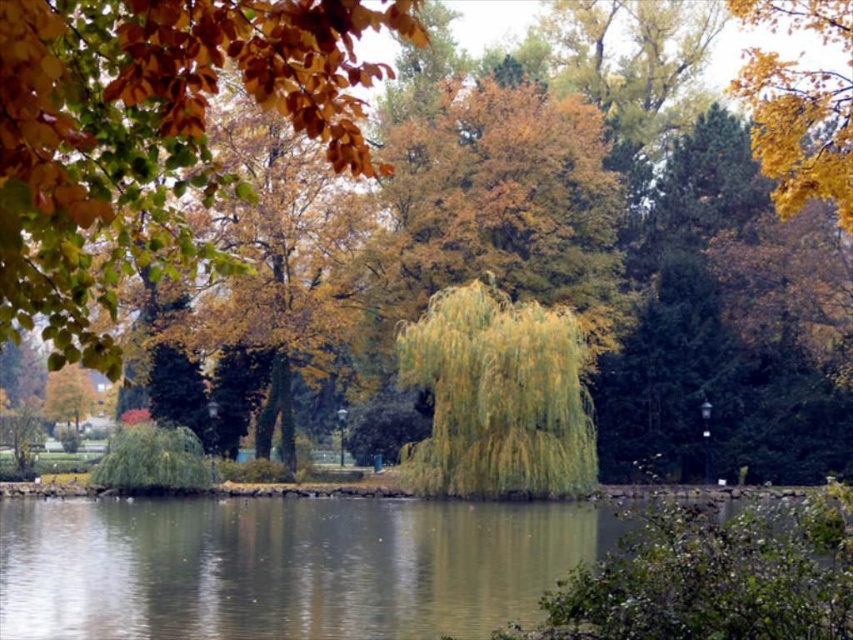
Describe the element at coordinates (285, 566) in the screenshot. I see `greenish reflective water at center` at that location.

This screenshot has height=640, width=853. I want to click on greenish reflective water at center, so click(x=285, y=566).

Describe the element at coordinates (149, 134) in the screenshot. I see `yellow-green leaves at upper left` at that location.

Does yellow-green leaves at upper left have a lesser width compared to yellow/golden leaves at upper right?

Indeed, yellow-green leaves at upper left has a lesser width compared to yellow/golden leaves at upper right.

I want to click on yellow-green leaves at upper left, so click(149, 134).

Between yellow-green leaves at upper left and greenish reflective water at center, which one appears on the left side from the viewer's perspective?

yellow-green leaves at upper left

Between yellow-green leaves at upper left and greenish reflective water at center, which one is positioned higher?

yellow-green leaves at upper left is higher up.

Who is more distant from viewer, [309,84] or [88,554]?

The point [88,554] is behind.

Locate an element on the screen. This screenshot has height=640, width=853. yellow-green leaves at upper left is located at coordinates (149, 134).